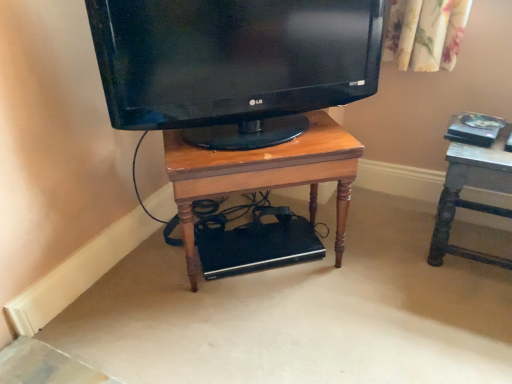
This screenshot has height=384, width=512. I want to click on matte black tv at center, so click(233, 64).

What do you see at coordinates (474, 187) in the screenshot? I see `wooden table at right` at bounding box center [474, 187].

Locate an element on the screen. matte black tv at center is located at coordinates (233, 64).

Considering the positions of objects wooden desk at center and matte black tv at center in the image provided, who is in front, wooden desk at center or matte black tv at center?

Positioned in front is matte black tv at center.

In terms of width, does wooden desk at center look wider or thinner when compared to matte black tv at center?

Clearly, wooden desk at center has more width compared to matte black tv at center.

Considering the points (184, 227) and (280, 63), which point is behind, point (184, 227) or point (280, 63)?

Positioned behind is point (184, 227).

Considering the relative positions of wooden desk at center and matte black tv at center in the image provided, is wooden desk at center to the right of matte black tv at center from the viewer's perspective?

Correct, you'll find wooden desk at center to the right of matte black tv at center.

From the image's perspective, which is below, matte black tv at center or wooden desk at center?

wooden desk at center is shown below in the image.

Could you tell me if matte black tv at center is turned towards wooden desk at center?

No, matte black tv at center is not turned towards wooden desk at center.

From a real-world perspective, is matte black tv at center positioned above or below wooden desk at center?

From a real-world perspective, matte black tv at center is physically above wooden desk at center.

Is wooden desk at center facing away from wooden table at right?

That's not correct — wooden desk at center is not looking away from wooden table at right.

From their relative heights in the image, would you say wooden desk at center is taller or shorter than wooden table at right?

Clearly, wooden desk at center is taller compared to wooden table at right.

Based on the photo, is wooden table at right inside wooden desk at center?

No, wooden table at right is not surrounded by wooden desk at center.

Would you say wooden desk at center is to the left or to the right of wooden table at right in the picture?

From the image, it's evident that wooden desk at center is to the left of wooden table at right.

Considering the relative sizes of wooden table at right and matte black tv at center in the image provided, is wooden table at right smaller than matte black tv at center?

Indeed, wooden table at right has a smaller size compared to matte black tv at center.

In the scene shown: From their relative heights in the image, would you say wooden table at right is taller or shorter than matte black tv at center?

wooden table at right is taller than matte black tv at center.

Is matte black tv at center inside wooden table at right?

No, matte black tv at center is not a part of wooden table at right.

What's the angular difference between wooden table at right and matte black tv at center's facing directions?

44.8 degrees.

From a real-world perspective, is wooden table at right positioned over wooden desk at center based on gravity?

No.

Is wooden table at right aimed at wooden desk at center?

No, wooden table at right is not facing towards wooden desk at center.

Can you tell me how much wooden table at right and wooden desk at center differ in facing direction?

The facing directions of wooden table at right and wooden desk at center are 40.3 degrees apart.

Could you tell me if matte black tv at center is turned towards wooden table at right?

No, matte black tv at center is not aimed at wooden table at right.

Looking at this image, are matte black tv at center and wooden table at right located far from each other?

They are positioned close to each other.

Between matte black tv at center and wooden table at right, which one has less height?

matte black tv at center is shorter.

Where is `television in front of the wooden desk at center`? Image resolution: width=512 pixels, height=384 pixels. television in front of the wooden desk at center is located at coordinates (233, 64).

In the image, there is a matte black tv at center. Where is `desk below it (from the image's perspective)`? desk below it (from the image's perspective) is located at coordinates (264, 173).

Considering their positions, is wooden table at right positioned closer to matte black tv at center than wooden desk at center?

wooden desk at center is positioned closer to the anchor matte black tv at center.

From the image, which object appears to be farther from wooden desk at center, wooden table at right or matte black tv at center?

wooden table at right is positioned further to the anchor wooden desk at center.

When comparing their distances from matte black tv at center, does wooden desk at center or wooden table at right seem closer?

wooden desk at center is positioned closer to the anchor matte black tv at center.

Based on the photo, which object lies nearer to the anchor point wooden table at right, matte black tv at center or wooden desk at center?

wooden desk at center lies closer to wooden table at right than the other object.

Looking at the image, which one is located closer to wooden table at right, wooden desk at center or matte black tv at center?

Among the two, wooden desk at center is located nearer to wooden table at right.

Based on their spatial positions, is matte black tv at center or wooden table at right further from wooden desk at center?

Among the two, wooden table at right is located further to wooden desk at center.

Where is `desk between matte black tv at center and wooden table at right`? The width and height of the screenshot is (512, 384). desk between matte black tv at center and wooden table at right is located at coordinates (264, 173).